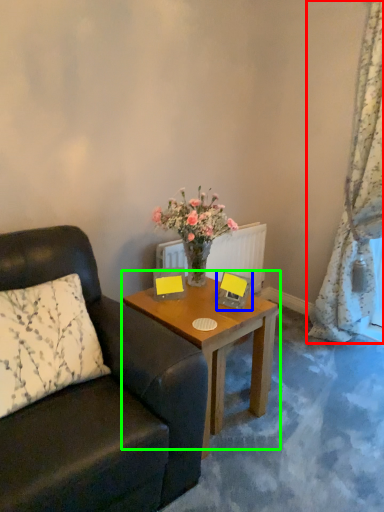
Question: Considering the real-world distances, which object is closest to curtain (highlighted by a red box)? picture frame (highlighted by a blue box) or coffee table (highlighted by a green box).

Choices:
 (A) picture frame
 (B) coffee table

Answer: (B)